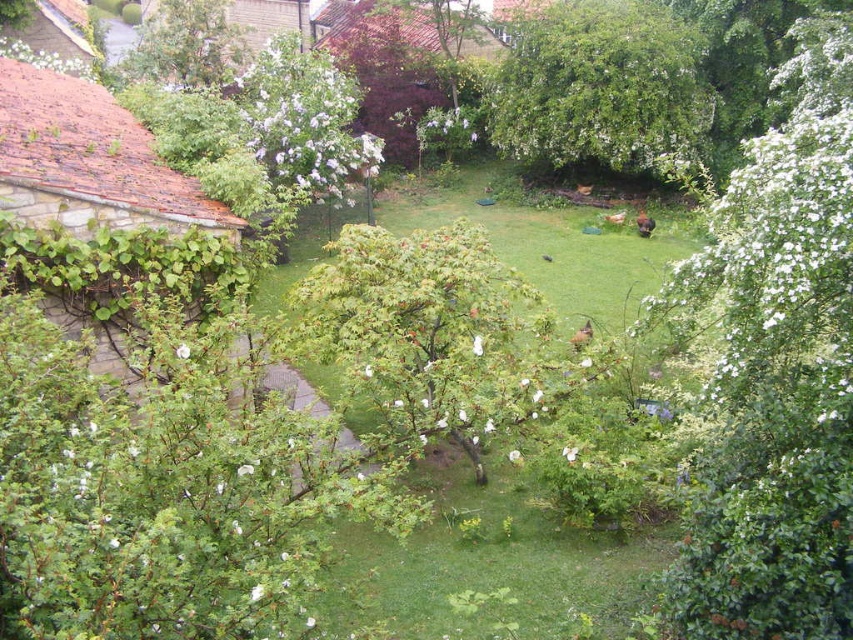
You are a gardener who wants to mow the green grass at center. However, you notice the green leafy tree at upper left is in the way. Can you mow the grass without damaging the tree?

The green grass at center is much taller than the green leafy tree at upper left. Therefore, you can mow the grass without damaging the tree because the tree is shorter and the grass is taller.

You are planning to place a new bench in the garden. The bench requires a space wider than the white fluffy bush at right. Can the green leafy tree at upper left provide enough space for the bench?

The white fluffy bush at right is wider than the green leafy tree at upper left, so the space under the green leafy tree at upper left is narrower than required for the bench.